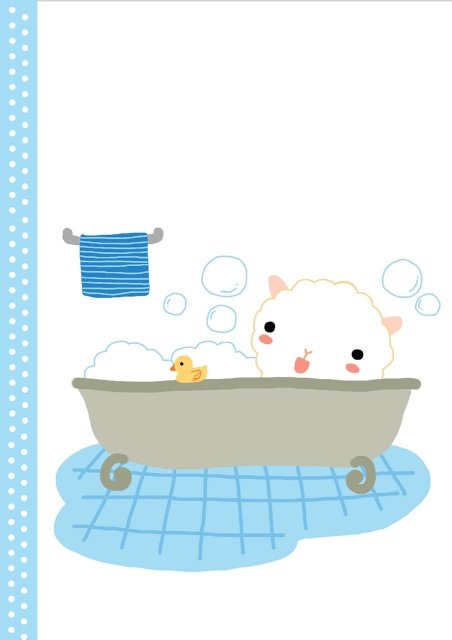
Does fluffy white lamb at center have a lesser height compared to yellow rubber duck at center?

No.

Is fluffy white lamb at center above yellow rubber duck at center?

Correct, fluffy white lamb at center is located above yellow rubber duck at center.

The image size is (452, 640). What are the coordinates of `fluffy white lamb at center` in the screenshot? It's located at [x=320, y=332].

Locate an element on the screen. The width and height of the screenshot is (452, 640). fluffy white lamb at center is located at coordinates (320, 332).

Is smooth beige bathtub at center positioned at the back of yellow rubber duck at center?

No, it is in front of yellow rubber duck at center.

Is point (343, 416) behind point (184, 374)?

No, (343, 416) is in front of (184, 374).

Locate an element on the screen. This screenshot has height=640, width=452. smooth beige bathtub at center is located at coordinates (245, 420).

Is point (315, 422) positioned behind point (371, 358)?

No, (315, 422) is in front of (371, 358).

Is smooth beige bathtub at center wider than fluffy white lamb at center?

Indeed, smooth beige bathtub at center has a greater width compared to fluffy white lamb at center.

Locate an element on the screen. The height and width of the screenshot is (640, 452). smooth beige bathtub at center is located at coordinates (245, 420).